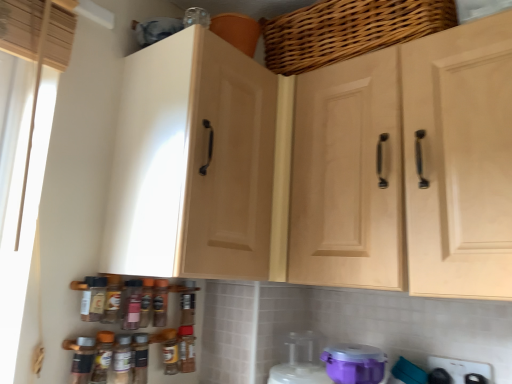
Question: Is purple plastic container at lower center, positioned as the 1th appliance in left-to-right order, inside the boundaries of light wood cabinet doors at center, positioned as the 1th cabinetry in right-to-left order, or outside?

Choices:
 (A) outside
 (B) inside

Answer: (A)

Question: From the image's perspective, is purple plastic container at lower center, the 4th appliance from the right, above or below light wood cabinet doors at center, positioned as the 1th cabinetry in right-to-left order?

Choices:
 (A) below
 (B) above

Answer: (A)

Question: Which object is positioned closest to the light wood cabinet doors at center, positioned as the 1th cabinetry in right-to-left order?

Choices:
 (A) woven wood basket at upper center
 (B) purple plastic container at lower center, which is counted as the second appliance, starting from the right
 (C) matte wood cabinet at left, the 2th cabinetry positioned from the right
 (D) white glossy stove at lower right, the first appliance viewed from the right
 (E) purple plastic container at lower center, which is counted as the 3th appliance, starting from the right

Answer: (C)

Question: Based on their relative distances, which object is nearer to the purple plastic container at lower center, the second appliance positioned from the left?

Choices:
 (A) light wood cabinet doors at center, positioned as the 1th cabinetry in right-to-left order
 (B) woven wood basket at upper center
 (C) white glossy stove at lower right, the first appliance viewed from the right
 (D) purple plastic container at lower center, positioned as the 1th appliance in left-to-right order
 (E) matte wood cabinet at left, marked as the first cabinetry in a left-to-right arrangement

Answer: (D)